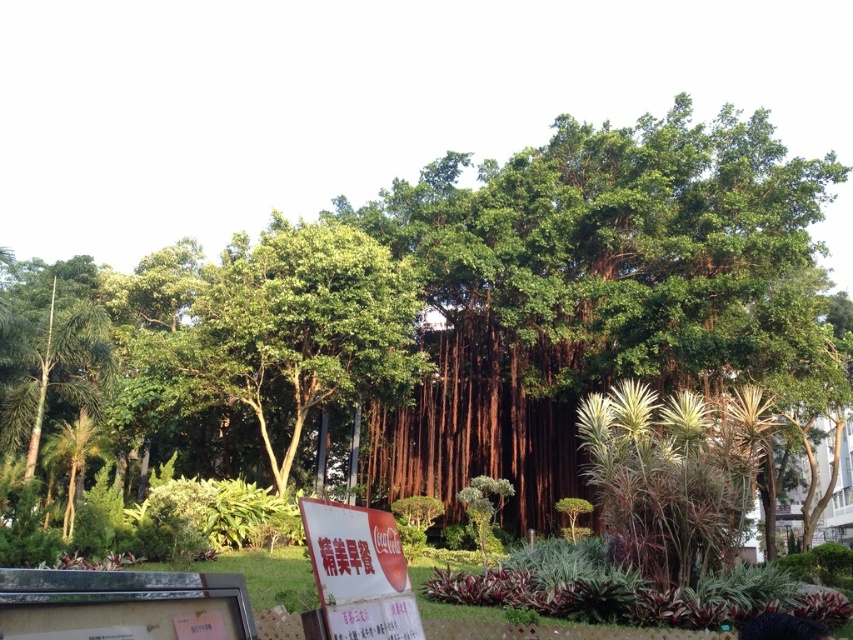
You are standing in the park and see two points marked in the image. Which point is closer to you, point (432, 241) or point (407, 612)?

Point (407, 612) is closer to you because it is less further to the camera than point (432, 241).

You are standing in the park and want to read the white paper sign at lower center. The green leafy banyan tree at center is blocking your view. Which direction should you move to get a clear view of the sign?

You should move to the left of the green leafy banyan tree at center to get a clear view of the white paper sign at lower center since the tree is to the right of the sign.